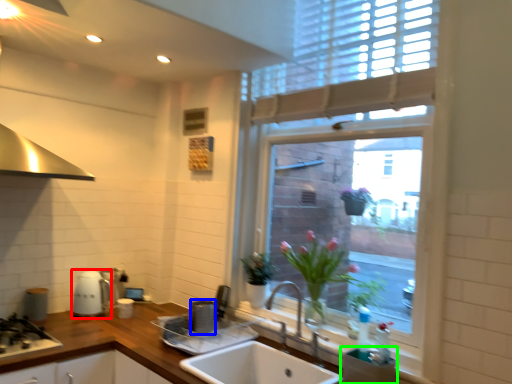
Question: Which object is positioned farthest from appliance (highlighted by a red box)? Select from appliance (highlighted by a blue box) and appliance (highlighted by a green box).

Choices:
 (A) appliance
 (B) appliance

Answer: (B)